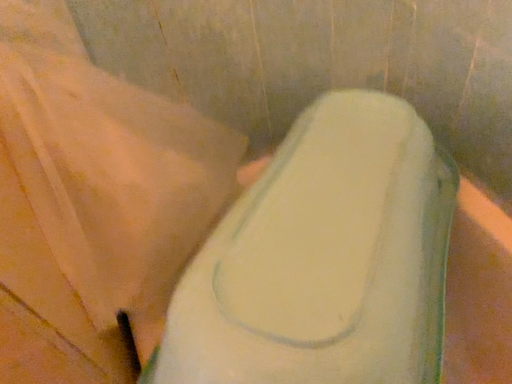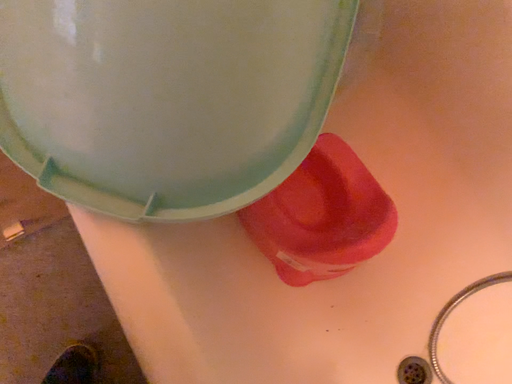
Question: How did the camera likely rotate when shooting the video?

Choices:
 (A) rotated right
 (B) rotated left

Answer: (A)